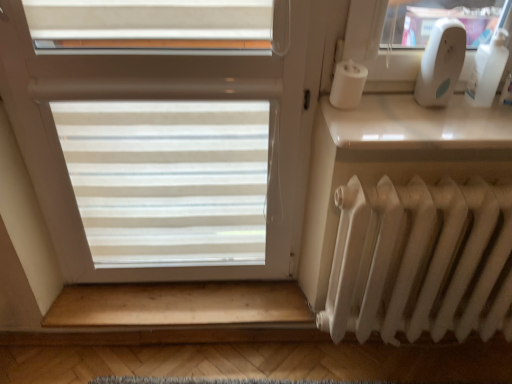
Where is `vacant position to the left of white plastic bottle at upper right`? Image resolution: width=512 pixels, height=384 pixels. vacant position to the left of white plastic bottle at upper right is located at coordinates (440, 112).